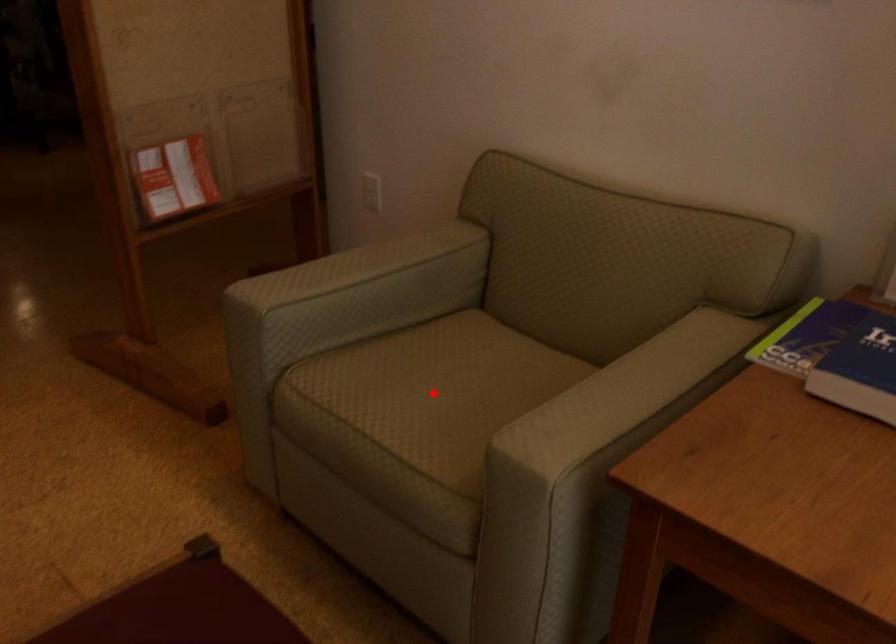
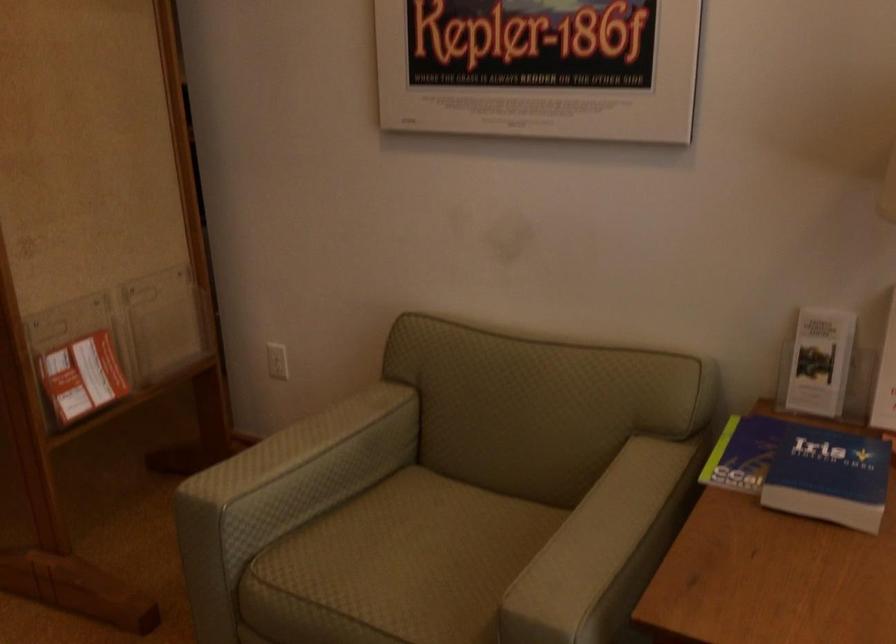
Locate, in the second image, the point that corresponds to the highlighted location in the first image.

(407, 563)